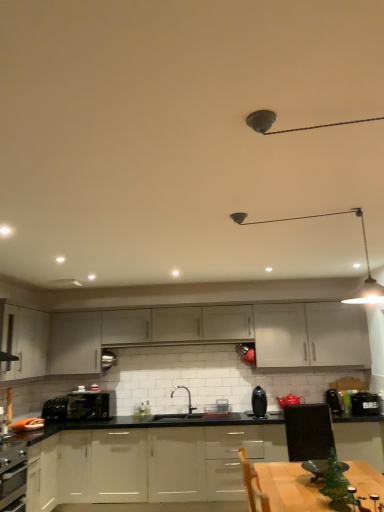
Question: In terms of height, does metallic silver toaster at center, which ranks as the first kitchen appliance in back-to-front order, look taller or shorter compared to white matte cabinet at center, the third cabinetry in the bottom-to-top sequence?

Choices:
 (A) tall
 (B) short

Answer: (B)

Question: From the image's perspective, relative to white matte cabinet at center, the third cabinetry in the bottom-to-top sequence, is metallic silver toaster at center, acting as the second kitchen appliance starting from the right, above or below?

Choices:
 (A) above
 (B) below

Answer: (B)

Question: Considering the real-world distances, which object is closest to the metallic pendant light at upper center?

Choices:
 (A) black plastic toaster at lower left, placed as the 1th appliance when sorted from left to right
 (B) white matte cabinet at center, the 4th cabinetry in the bottom-to-top sequence
 (C) metallic silver toaster at center, which ranks as the first kitchen appliance in back-to-front order
 (D) matte gray cabinet at center, the 3th cabinetry when ordered from top to bottom
 (E) satin black vase at center, the 1th kitchen appliance when ordered from right to left

Answer: (B)

Question: Considering the real-world distances, which object is closest to the satin black vase at center, the 2th kitchen appliance viewed from the left?

Choices:
 (A) black plastic toaster at lower left, which ranks as the second appliance in right-to-left order
 (B) white glossy cabinets at center, which is the fourth cabinetry from top to bottom
 (C) matte gray cabinet at center, the 3th cabinetry when ordered from top to bottom
 (D) green matte christmas tree at lower right
 (E) metallic pendant light at upper center

Answer: (B)